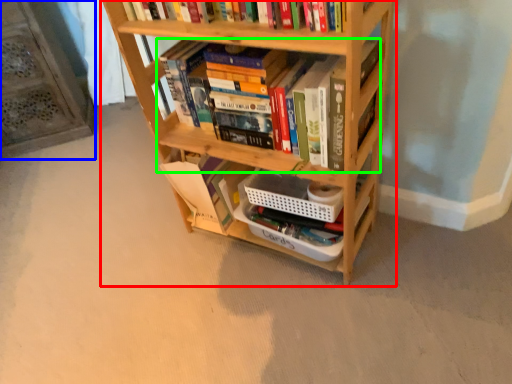
Question: Estimate the real-world distances between objects in this image. Which object is closer to bookcase (highlighted by a red box), shelf (highlighted by a blue box) or book (highlighted by a green box)?

Choices:
 (A) shelf
 (B) book

Answer: (B)